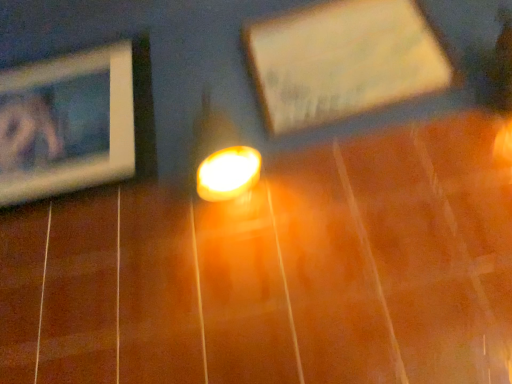
Find the location of a particular element. wooden picture frame at left, placed as the first picture frame when sorted from left to right is located at coordinates (77, 122).

What do you see at coordinates (77, 122) in the screenshot? I see `wooden picture frame at left, placed as the first picture frame when sorted from left to right` at bounding box center [77, 122].

At what (x,y) coordinates should I click in order to perform the action: click on wooden picture frame at upper center, marked as the first picture frame in a right-to-left arrangement. Please return your answer as a coordinate pair (x, y). Looking at the image, I should click on (344, 61).

Describe the element at coordinates (344, 61) in the screenshot. I see `wooden picture frame at upper center, which is the second picture frame from left to right` at that location.

Identify the location of wooden picture frame at left, placed as the first picture frame when sorted from left to right. (77, 122).

Considering the relative positions of wooden picture frame at left, placed as the first picture frame when sorted from left to right, and wooden picture frame at upper center, which is the second picture frame from left to right, in the image provided, is wooden picture frame at left, placed as the first picture frame when sorted from left to right, to the left or to the right of wooden picture frame at upper center, which is the second picture frame from left to right,?

In the image, wooden picture frame at left, placed as the first picture frame when sorted from left to right, appears on the left side of wooden picture frame at upper center, which is the second picture frame from left to right.

Which object is further away from the camera, wooden picture frame at left, placed as the first picture frame when sorted from left to right, or wooden picture frame at upper center, which is the second picture frame from left to right?

Positioned behind is wooden picture frame at left, placed as the first picture frame when sorted from left to right.

Is point (92, 106) farther from viewer compared to point (306, 121)?

Yes, it is behind point (306, 121).

From the image's perspective, which one is positioned lower, wooden picture frame at left, the 2th picture frame when ordered from right to left, or wooden picture frame at upper center, which is the second picture frame from left to right?

wooden picture frame at left, the 2th picture frame when ordered from right to left.

From a real-world perspective, is wooden picture frame at left, placed as the first picture frame when sorted from left to right, positioned above or below wooden picture frame at upper center, which is the second picture frame from left to right?

wooden picture frame at left, placed as the first picture frame when sorted from left to right, is situated higher than wooden picture frame at upper center, which is the second picture frame from left to right, in the real world.

Consider the image. Which object is wider, wooden picture frame at left, the 2th picture frame when ordered from right to left, or wooden picture frame at upper center, marked as the first picture frame in a right-to-left arrangement?

Wider between the two is wooden picture frame at upper center, marked as the first picture frame in a right-to-left arrangement.

Is wooden picture frame at left, placed as the first picture frame when sorted from left to right, taller or shorter than wooden picture frame at upper center, marked as the first picture frame in a right-to-left arrangement?

wooden picture frame at left, placed as the first picture frame when sorted from left to right, is taller than wooden picture frame at upper center, marked as the first picture frame in a right-to-left arrangement.

Which of these two, wooden picture frame at left, the 2th picture frame when ordered from right to left, or wooden picture frame at upper center, which is the second picture frame from left to right, is smaller?

wooden picture frame at upper center, which is the second picture frame from left to right, is smaller.

Is wooden picture frame at left, the 2th picture frame when ordered from right to left, spatially inside wooden picture frame at upper center, which is the second picture frame from left to right, or outside of it?

wooden picture frame at left, the 2th picture frame when ordered from right to left, cannot be found inside wooden picture frame at upper center, which is the second picture frame from left to right.

Would you say wooden picture frame at left, the 2th picture frame when ordered from right to left, is a long distance from wooden picture frame at upper center, which is the second picture frame from left to right?

No, wooden picture frame at left, the 2th picture frame when ordered from right to left, is not far away from wooden picture frame at upper center, which is the second picture frame from left to right.

Could you tell me if wooden picture frame at left, the 2th picture frame when ordered from right to left, is facing wooden picture frame at upper center, marked as the first picture frame in a right-to-left arrangement?

No, wooden picture frame at left, the 2th picture frame when ordered from right to left, is not facing towards wooden picture frame at upper center, marked as the first picture frame in a right-to-left arrangement.

How different are the orientations of wooden picture frame at left, placed as the first picture frame when sorted from left to right, and wooden picture frame at upper center, which is the second picture frame from left to right, in degrees?

The angle between the facing direction of wooden picture frame at left, placed as the first picture frame when sorted from left to right, and the facing direction of wooden picture frame at upper center, which is the second picture frame from left to right, is 1.7 degrees.

In order to click on picture frame that appears on the right of wooden picture frame at left, placed as the first picture frame when sorted from left to right in this screenshot , I will do coord(344,61).

Which object is positioned more to the left, wooden picture frame at upper center, which is the second picture frame from left to right, or wooden picture frame at left, placed as the first picture frame when sorted from left to right?

wooden picture frame at left, placed as the first picture frame when sorted from left to right, is more to the left.

Based on the photo, is the position of wooden picture frame at upper center, marked as the first picture frame in a right-to-left arrangement, more distant than that of wooden picture frame at left, placed as the first picture frame when sorted from left to right?

No, the depth of wooden picture frame at upper center, marked as the first picture frame in a right-to-left arrangement, is less than that of wooden picture frame at left, placed as the first picture frame when sorted from left to right.

Does point (285, 58) appear closer or farther from the camera than point (37, 141)?

Point (285, 58).

From the image's perspective, is wooden picture frame at upper center, marked as the first picture frame in a right-to-left arrangement, on top of wooden picture frame at left, the 2th picture frame when ordered from right to left?

Yes, from the image's perspective, wooden picture frame at upper center, marked as the first picture frame in a right-to-left arrangement, is over wooden picture frame at left, the 2th picture frame when ordered from right to left.

From a real-world perspective, is wooden picture frame at upper center, which is the second picture frame from left to right, positioned above or below wooden picture frame at left, placed as the first picture frame when sorted from left to right?

wooden picture frame at upper center, which is the second picture frame from left to right, is below wooden picture frame at left, placed as the first picture frame when sorted from left to right.

Between wooden picture frame at upper center, which is the second picture frame from left to right, and wooden picture frame at left, the 2th picture frame when ordered from right to left, which one has larger width?

Wider between the two is wooden picture frame at upper center, which is the second picture frame from left to right.

Consider the image. From their relative heights in the image, would you say wooden picture frame at upper center, marked as the first picture frame in a right-to-left arrangement, is taller or shorter than wooden picture frame at left, the 2th picture frame when ordered from right to left?

wooden picture frame at upper center, marked as the first picture frame in a right-to-left arrangement, is shorter than wooden picture frame at left, the 2th picture frame when ordered from right to left.

Considering the sizes of objects wooden picture frame at upper center, which is the second picture frame from left to right, and wooden picture frame at left, the 2th picture frame when ordered from right to left, in the image provided, who is bigger, wooden picture frame at upper center, which is the second picture frame from left to right, or wooden picture frame at left, the 2th picture frame when ordered from right to left,?

wooden picture frame at left, the 2th picture frame when ordered from right to left.

Looking at this image, can we say wooden picture frame at upper center, marked as the first picture frame in a right-to-left arrangement, lies outside wooden picture frame at left, placed as the first picture frame when sorted from left to right?

Absolutely, wooden picture frame at upper center, marked as the first picture frame in a right-to-left arrangement, is external to wooden picture frame at left, placed as the first picture frame when sorted from left to right.

Does wooden picture frame at upper center, marked as the first picture frame in a right-to-left arrangement, touch wooden picture frame at left, the 2th picture frame when ordered from right to left?

There is a gap between wooden picture frame at upper center, marked as the first picture frame in a right-to-left arrangement, and wooden picture frame at left, the 2th picture frame when ordered from right to left.

Is wooden picture frame at left, the 2th picture frame when ordered from right to left, at the back of wooden picture frame at upper center, which is the second picture frame from left to right?

wooden picture frame at upper center, which is the second picture frame from left to right, does not have its back to wooden picture frame at left, the 2th picture frame when ordered from right to left.

How different are the orientations of wooden picture frame at upper center, marked as the first picture frame in a right-to-left arrangement, and wooden picture frame at left, placed as the first picture frame when sorted from left to right, in degrees?

The angular difference between wooden picture frame at upper center, marked as the first picture frame in a right-to-left arrangement, and wooden picture frame at left, placed as the first picture frame when sorted from left to right, is 1.7 degrees.

Consider the image. Measure the distance from wooden picture frame at upper center, which is the second picture frame from left to right, to wooden picture frame at left, placed as the first picture frame when sorted from left to right.

wooden picture frame at upper center, which is the second picture frame from left to right, and wooden picture frame at left, placed as the first picture frame when sorted from left to right, are 17.11 inches apart from each other.

Identify the location of picture frame below the wooden picture frame at left, the 2th picture frame when ordered from right to left (from a real-world perspective). (344, 61).

At what (x,y) coordinates should I click in order to perform the action: click on picture frame above the wooden picture frame at upper center, which is the second picture frame from left to right (from a real-world perspective). Please return your answer as a coordinate pair (x, y). This screenshot has height=384, width=512. Looking at the image, I should click on (77, 122).

At what (x,y) coordinates should I click in order to perform the action: click on picture frame located behind the wooden picture frame at upper center, marked as the first picture frame in a right-to-left arrangement. Please return your answer as a coordinate pair (x, y). The width and height of the screenshot is (512, 384). Looking at the image, I should click on (77, 122).